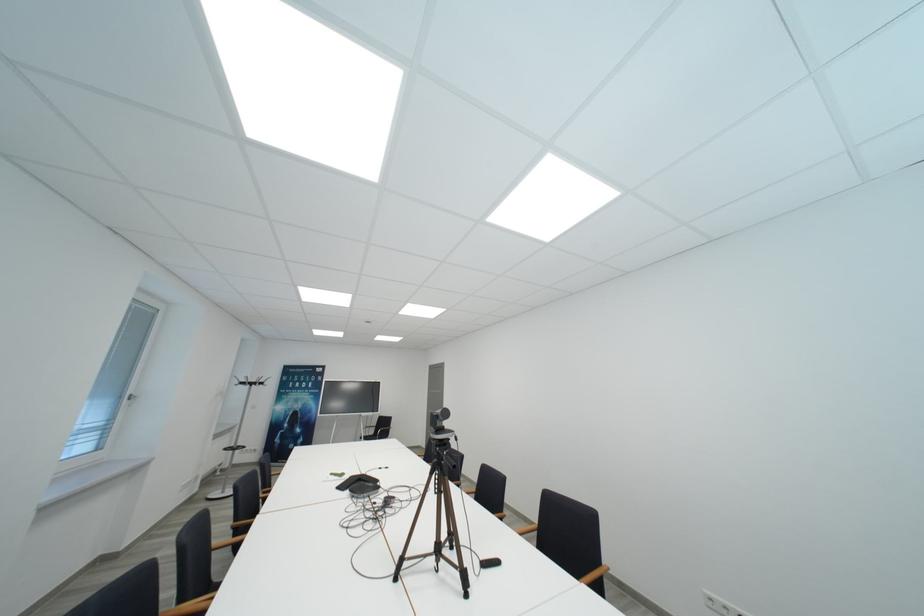
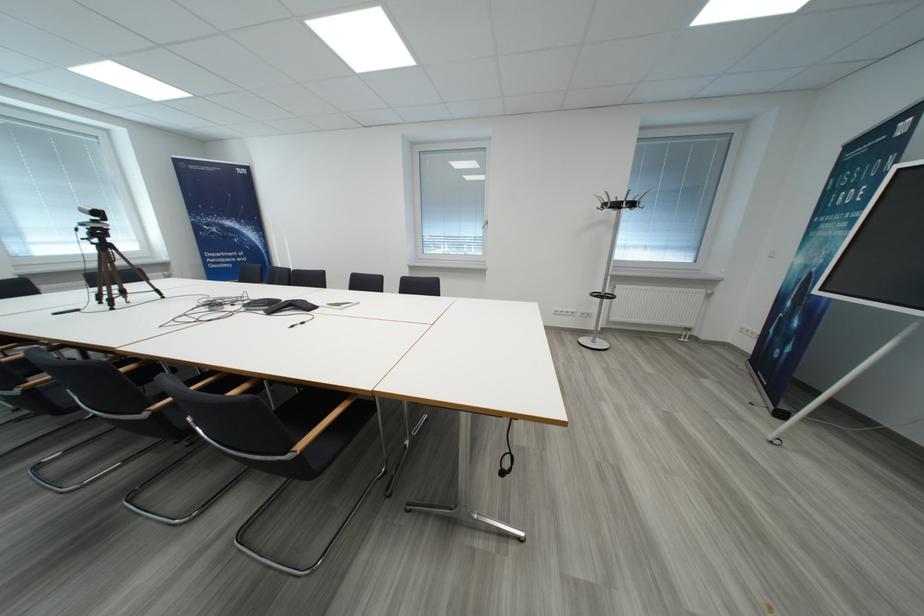
Locate, in the second image, the point that corresponds to (287,410) in the first image.

(807, 264)